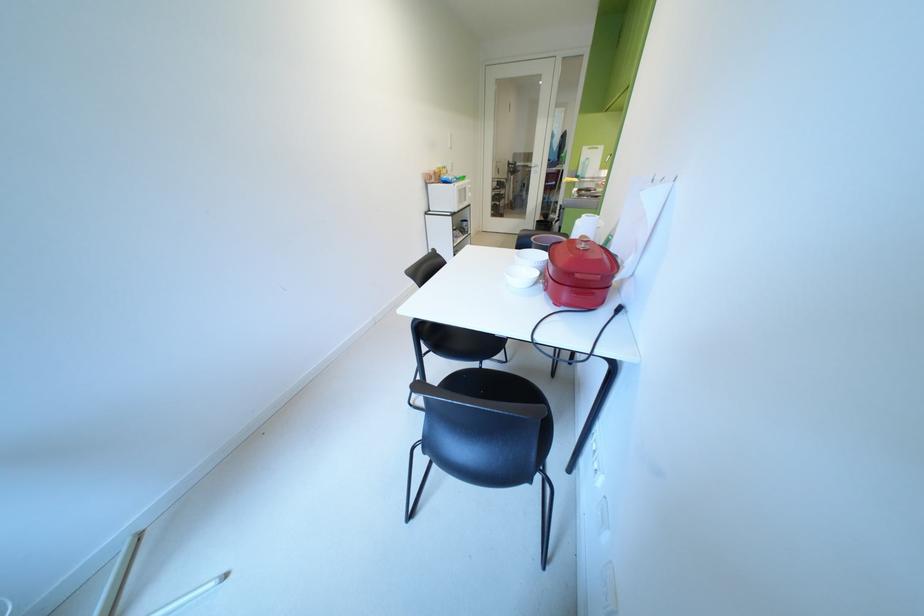
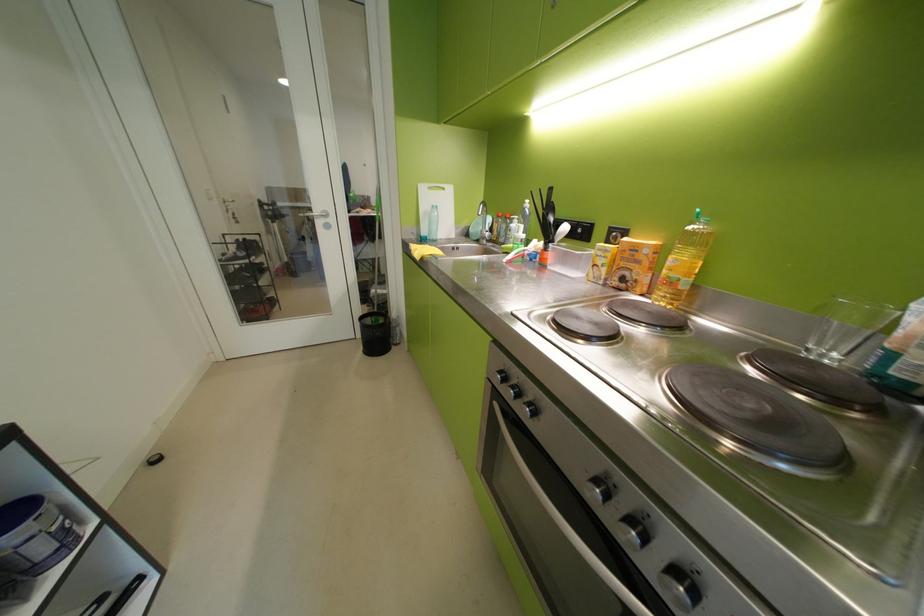
Where in the second image is the point corresponding to point 594,150 from the first image?

(433, 190)